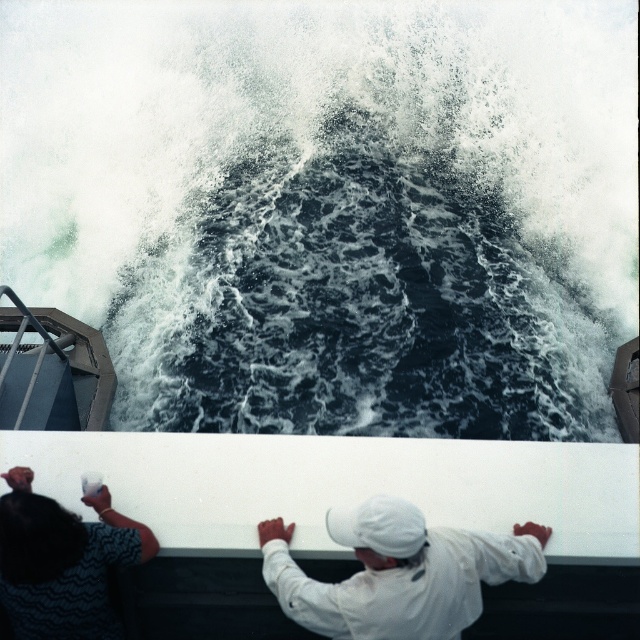
You are a photographer trying to capture the boat scene. You notice the dark blue water at center and the white matte cap at center. Which object should you focus on if you want to capture the larger subject in your shot?

The dark blue water at center is bigger than the white matte cap at center, so you should focus on the dark blue water at center to capture the larger subject.

Based on the scene description, which object is wider, the dark blue water at center or the white matte cap at center?

The dark blue water at center is wider than the white matte cap at center according to the description.